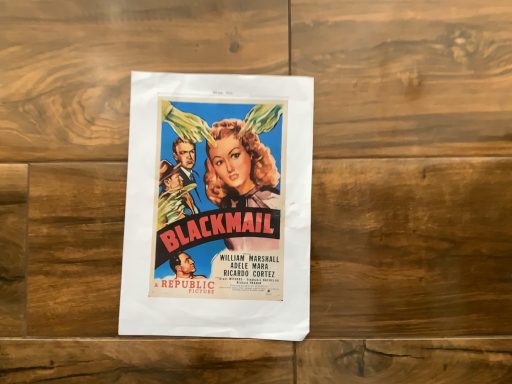
At what (x,y) coordinates should I click in order to perform the action: click on free point above matte paper poster at center (from a real-world perspective). Please return your answer as a coordinate pair (x, y). Looking at the image, I should click on (210, 210).